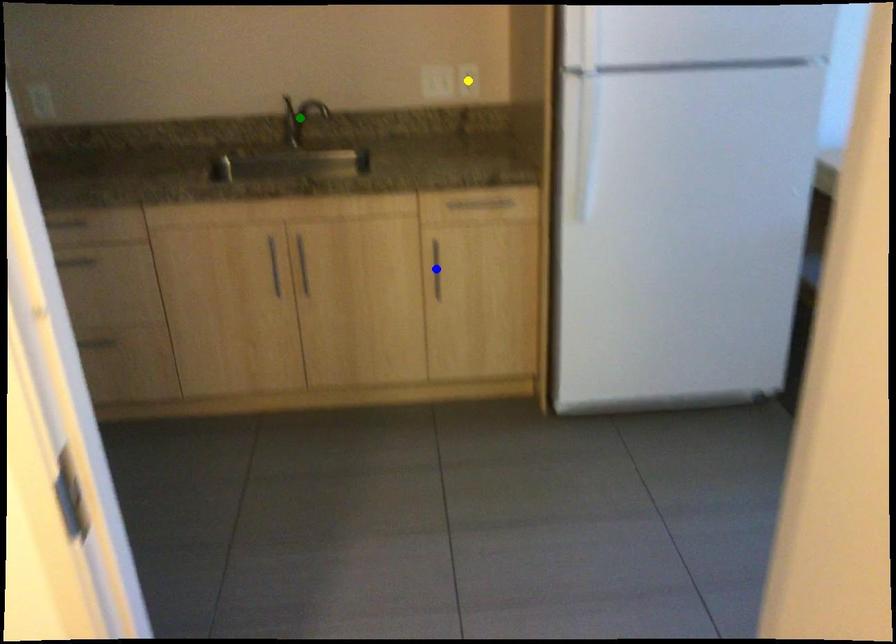
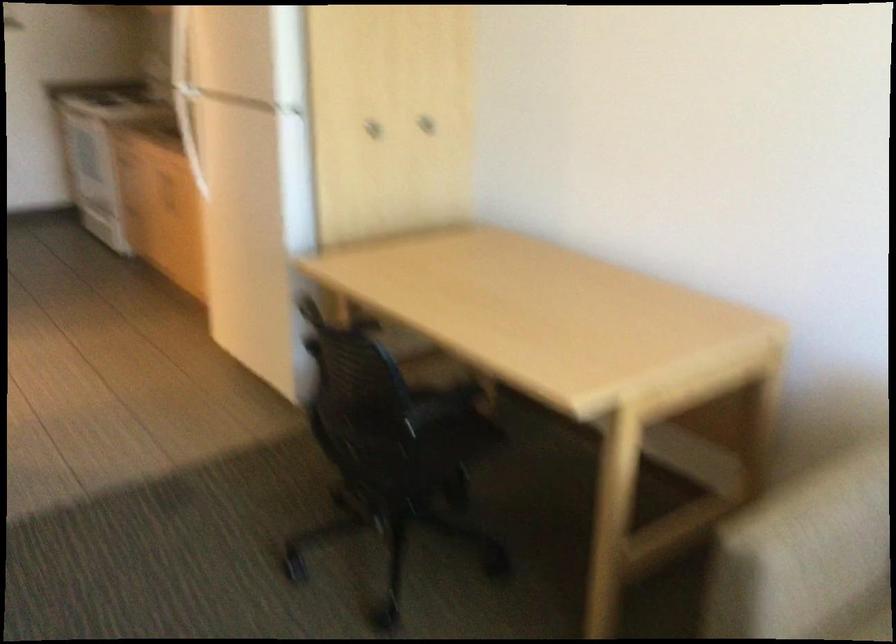
I am providing you with two images of the same scene from different viewpoints. Three points are marked in image1. Which point corresponds to a part or object that is occluded in image2?In image1, three points are marked. Which of them correspond to a part or object that is occluded in image2?Among the three points shown in image1, which one corresponds to a part or object that is no longer visible due to occlusion in image2?

Invisible in image2: blue point, green point, yellow point.